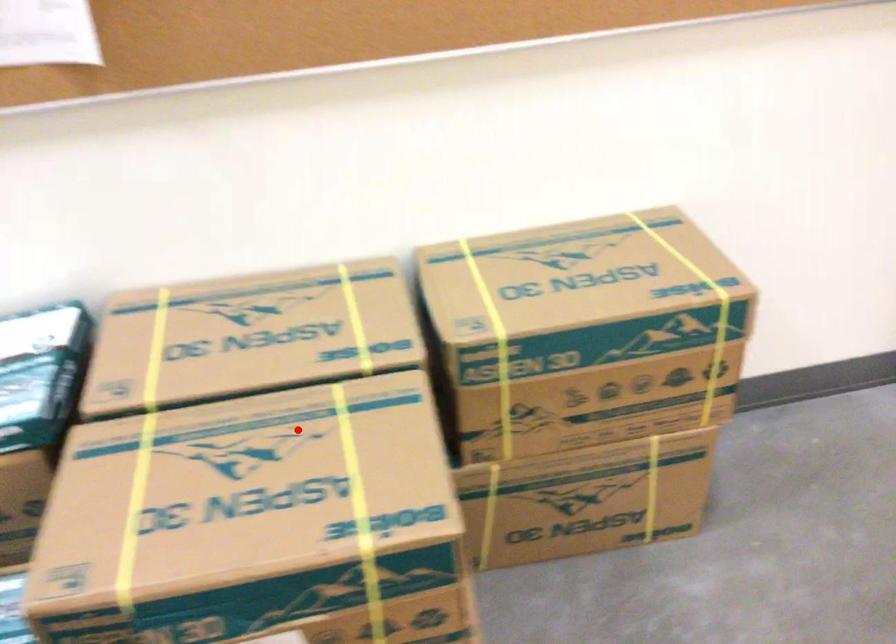
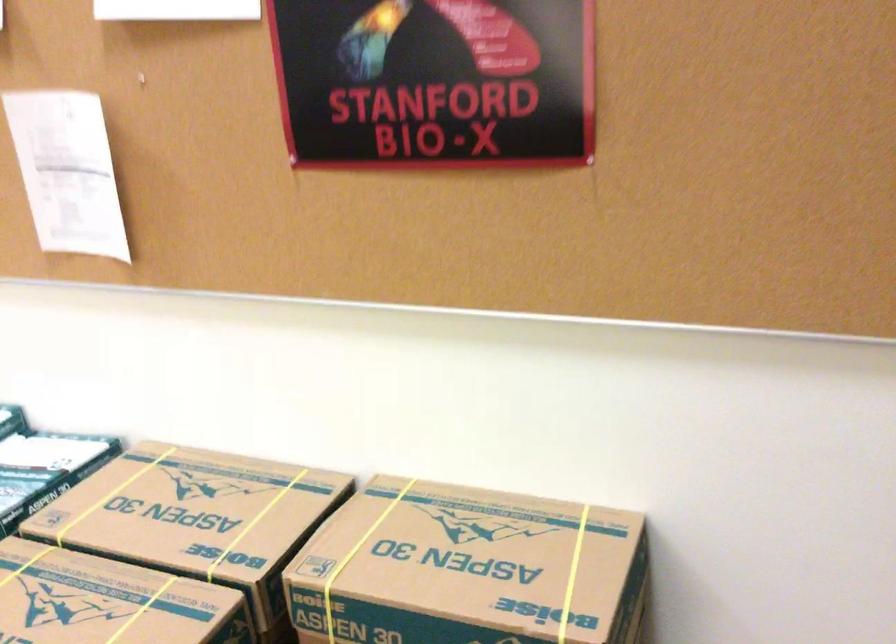
Question: I am providing you with two images of the same scene from different viewpoints. In image1, a red point is highlighted. Considering the same 3D point in image2, which of the following is correct?

Choices:
 (A) It is closer
 (B) It is farther

Answer: (B)